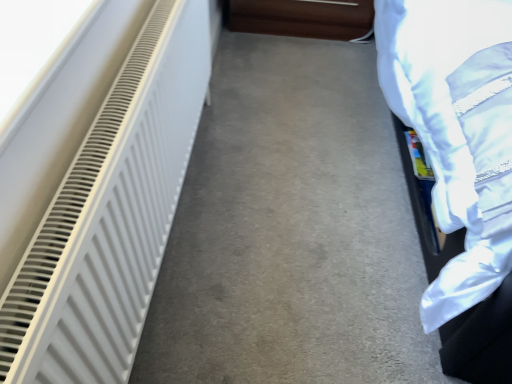
This screenshot has width=512, height=384. What are the coordinates of `vacant space in white matte radiator at left (from a real-world perspective)` in the screenshot? It's located at (169, 258).